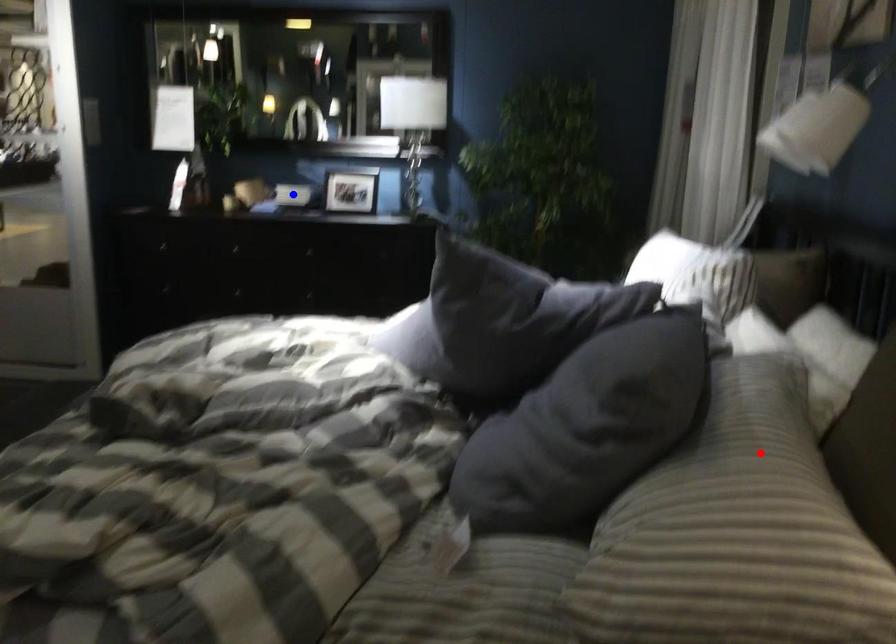
Question: In the image, two points are highlighted. Which point is nearer to the camera? Reply with the corresponding letter.

Choices:
 (A) blue point
 (B) red point

Answer: (B)